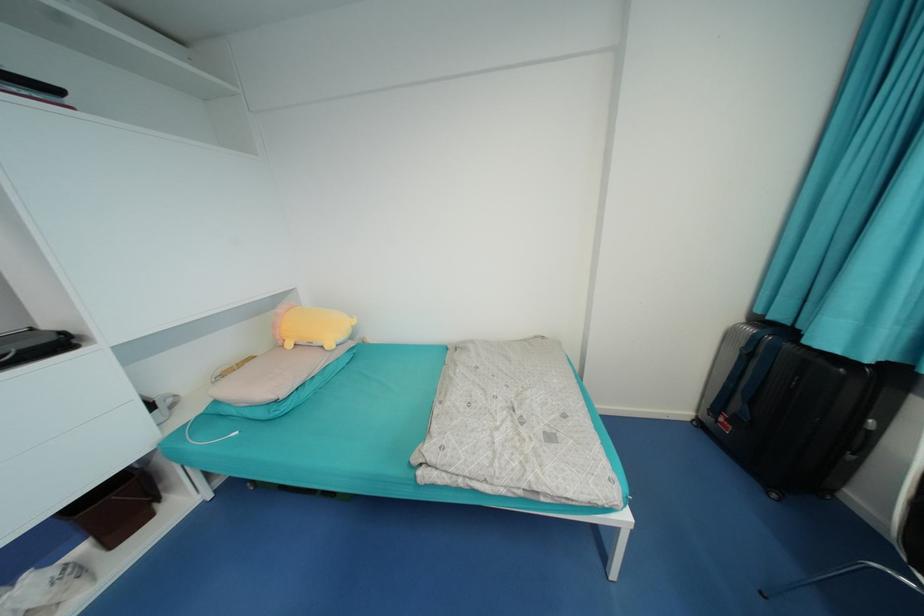
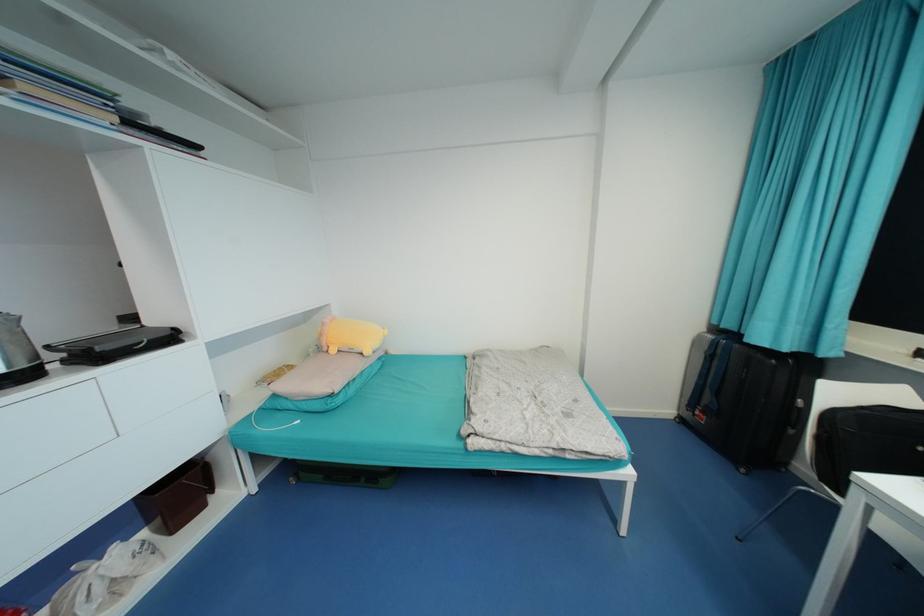
Find the pixel in the second image that matches (x=118, y=544) in the first image.

(177, 530)